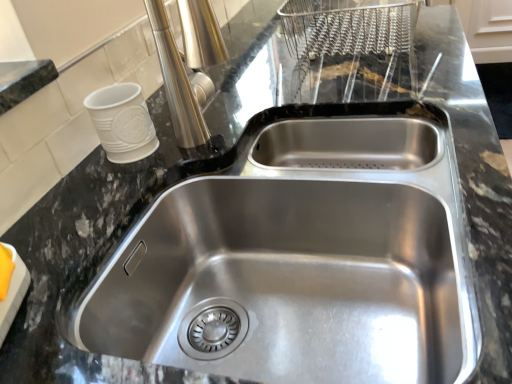
Question: Should I look upward or downward to see stainless steel sink at center?

Choices:
 (A) down
 (B) up

Answer: (A)